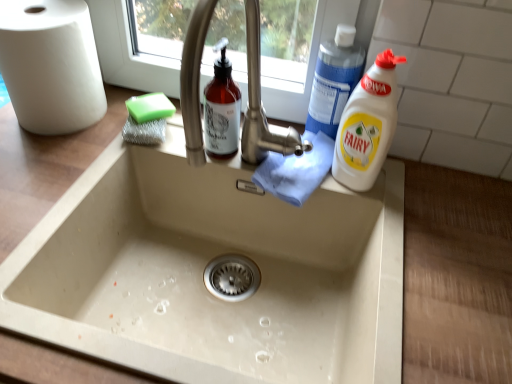
Identify the location of empty space that is ontop of white matte paper towel at left. (35, 7).